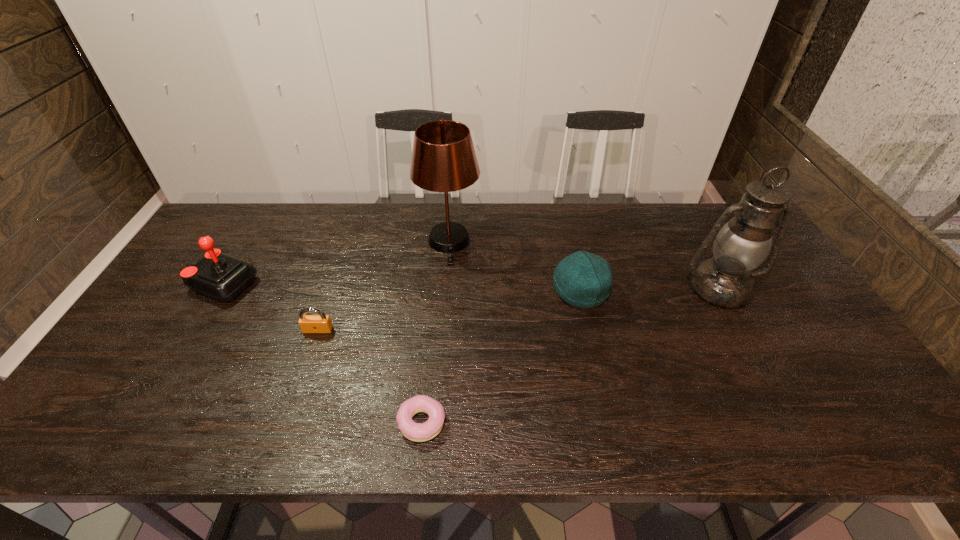
This screenshot has height=540, width=960. Identify the location of free space at the far edge of the desktop. (411, 232).

The image size is (960, 540). What are the coordinates of `vacant space at the near edge of the desktop` in the screenshot? It's located at (272, 415).

The width and height of the screenshot is (960, 540). I want to click on free space between the lampshade and the fifth object from left to right, so click(515, 266).

The width and height of the screenshot is (960, 540). Find the location of `free space between the padlock and the rightmost object`. free space between the padlock and the rightmost object is located at coordinates (518, 309).

At what (x,y) coordinates should I click in order to perform the action: click on free space between the leftmost object and the lampshade. Please return your answer as a coordinate pair (x, y). The height and width of the screenshot is (540, 960). Looking at the image, I should click on (335, 263).

Locate an element on the screen. The width and height of the screenshot is (960, 540). free space between the leftmost object and the rightmost object is located at coordinates (469, 286).

Where is `free space between the third tallest object and the lampshade`? free space between the third tallest object and the lampshade is located at coordinates (335, 263).

What are the coordinates of `vacant space that's between the nearest object and the third tallest object` in the screenshot? It's located at (322, 353).

At what (x,y) coordinates should I click in order to perform the action: click on vacant area that lies between the doughnut and the rightmost object. Please return your answer as a coordinate pair (x, y). This screenshot has width=960, height=540. Looking at the image, I should click on (570, 355).

The height and width of the screenshot is (540, 960). I want to click on empty space that is in between the oil lamp and the doughnut, so click(x=570, y=355).